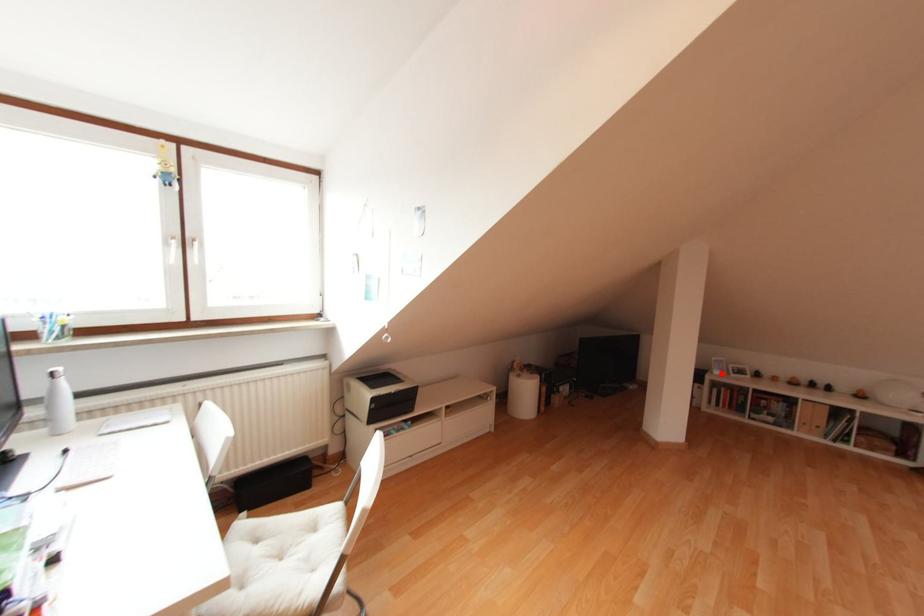
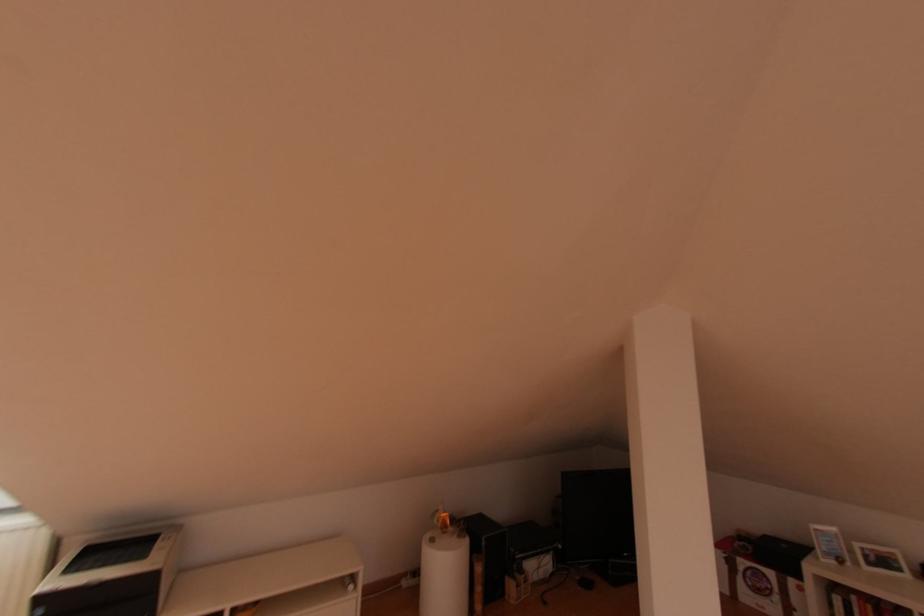
Question: I am providing you with two images of the same scene from different viewpoints. Image1 has a red point marked. In image2, the corresponding 3D location appears at what relative position? Reply with the corresponding letter.

Choices:
 (A) Closer
 (B) Farther

Answer: (A)